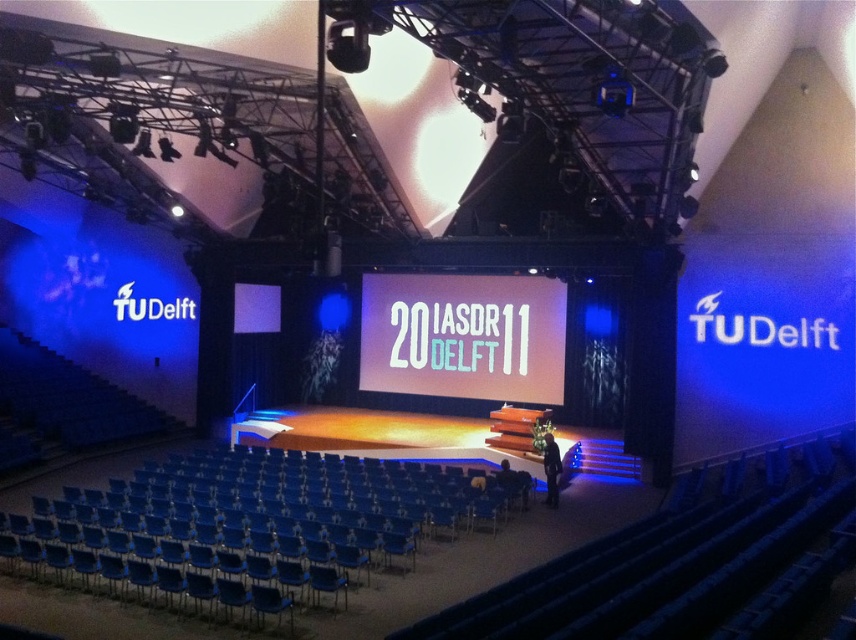
Is blue plastic chair at lower center smaller than white matte projection screen at center?

Indeed, blue plastic chair at lower center has a smaller size compared to white matte projection screen at center.

Measure the distance between blue plastic chair at lower center and white matte projection screen at center.

The distance of blue plastic chair at lower center from white matte projection screen at center is 40.19 feet.

What do you see at coordinates (248, 529) in the screenshot? I see `blue plastic chair at lower center` at bounding box center [248, 529].

Find the location of a particular element. blue plastic chair at lower center is located at coordinates (248, 529).